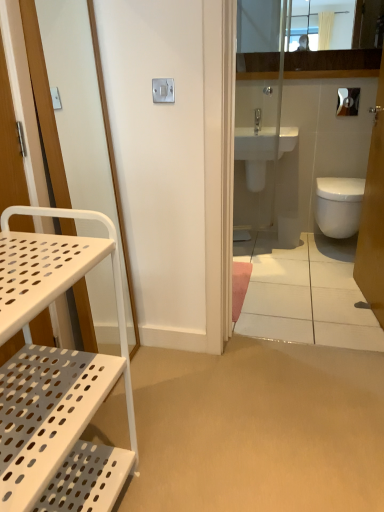
Question: From a real-world perspective, is white perforated metal cart at left physically above white glossy screen door at upper right, arranged as the 2th screen door when viewed from the left?

Choices:
 (A) yes
 (B) no

Answer: (B)

Question: Considering the relative positions of white perforated metal cart at left and white glossy screen door at upper right, arranged as the 2th screen door when viewed from the left, in the image provided, is white perforated metal cart at left behind white glossy screen door at upper right, arranged as the 2th screen door when viewed from the left,?

Choices:
 (A) no
 (B) yes

Answer: (A)

Question: Considering the relative sizes of white perforated metal cart at left and white glossy screen door at upper right, marked as the first screen door in a right-to-left arrangement, in the image provided, is white perforated metal cart at left smaller than white glossy screen door at upper right, marked as the first screen door in a right-to-left arrangement,?

Choices:
 (A) no
 (B) yes

Answer: (B)

Question: Is white perforated metal cart at left directly adjacent to white glossy screen door at upper right, marked as the first screen door in a right-to-left arrangement?

Choices:
 (A) no
 (B) yes

Answer: (A)

Question: Can we say white perforated metal cart at left lies outside white glossy screen door at upper right, marked as the first screen door in a right-to-left arrangement?

Choices:
 (A) yes
 (B) no

Answer: (A)

Question: From a real-world perspective, is white matte bidet at center, which ranks as the first bidet in left-to-right order, physically located above or below white glossy toilet at right?

Choices:
 (A) above
 (B) below

Answer: (B)

Question: In terms of size, does white matte bidet at center, which appears as the second bidet when viewed from the right, appear bigger or smaller than white glossy toilet at right?

Choices:
 (A) big
 (B) small

Answer: (B)

Question: Is white matte bidet at center, which ranks as the first bidet in left-to-right order, spatially inside white glossy toilet at right, or outside of it?

Choices:
 (A) outside
 (B) inside

Answer: (A)

Question: Relative to white glossy toilet at right, is white matte bidet at center, which appears as the second bidet when viewed from the right, in front or behind?

Choices:
 (A) behind
 (B) front

Answer: (A)

Question: Considering the relative positions of white glossy toilet paper at upper right and white glossy toilet at right in the image provided, is white glossy toilet paper at upper right to the left or to the right of white glossy toilet at right?

Choices:
 (A) left
 (B) right

Answer: (B)

Question: Is white glossy toilet paper at upper right wider or thinner than white glossy toilet at right?

Choices:
 (A) thin
 (B) wide

Answer: (A)

Question: Is white glossy toilet paper at upper right taller or shorter than white glossy toilet at right?

Choices:
 (A) short
 (B) tall

Answer: (A)

Question: Is white glossy toilet paper at upper right situated inside white glossy toilet at right or outside?

Choices:
 (A) inside
 (B) outside

Answer: (B)

Question: Is white glossy screen door at upper right, marked as the first screen door in a right-to-left arrangement, bigger or smaller than silver metallic lock at upper center?

Choices:
 (A) small
 (B) big

Answer: (B)

Question: From the image's perspective, is white glossy screen door at upper right, arranged as the 2th screen door when viewed from the left, located above or below silver metallic lock at upper center?

Choices:
 (A) above
 (B) below

Answer: (B)